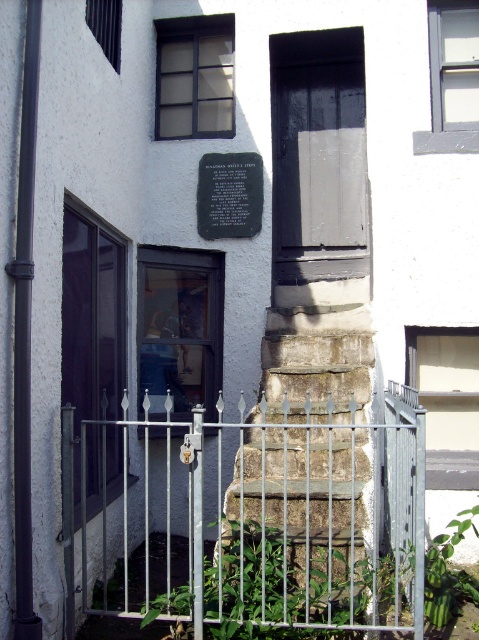
Can you confirm if green leafy plant at lower center is positioned to the left of matte glass door at left?

In fact, green leafy plant at lower center is to the right of matte glass door at left.

Which is in front, point (353, 618) or point (112, 481)?

Positioned in front is point (353, 618).

Which is behind, point (386, 625) or point (83, 323)?

Point (83, 323)

You are a GUI agent. You are given a task and a screenshot of the screen. Output one action in this format:
    pyautogui.click(x=<x>, y=<y>)
    Task: Click on the green leafy plant at lower center
    Image resolution: width=479 pixels, height=640 pixels.
    Given the screenshot: What is the action you would take?
    pyautogui.click(x=299, y=586)

Is metallic silver gate at center thinner than matte glass door at left?

No, metallic silver gate at center is not thinner than matte glass door at left.

Can you confirm if metallic silver gate at center is positioned to the left of matte glass door at left?

In fact, metallic silver gate at center is to the right of matte glass door at left.

Where is `metallic silver gate at center`? This screenshot has height=640, width=479. metallic silver gate at center is located at coordinates (252, 518).

Who is shorter, metallic silver gate at center or green leafy plant at lower center?

green leafy plant at lower center

Is metallic silver gate at center taller than green leafy plant at lower center?

Yes.

Does point (397, 602) come farther from viewer compared to point (238, 545)?

That is False.

This screenshot has width=479, height=640. Identify the location of metallic silver gate at center. (252, 518).